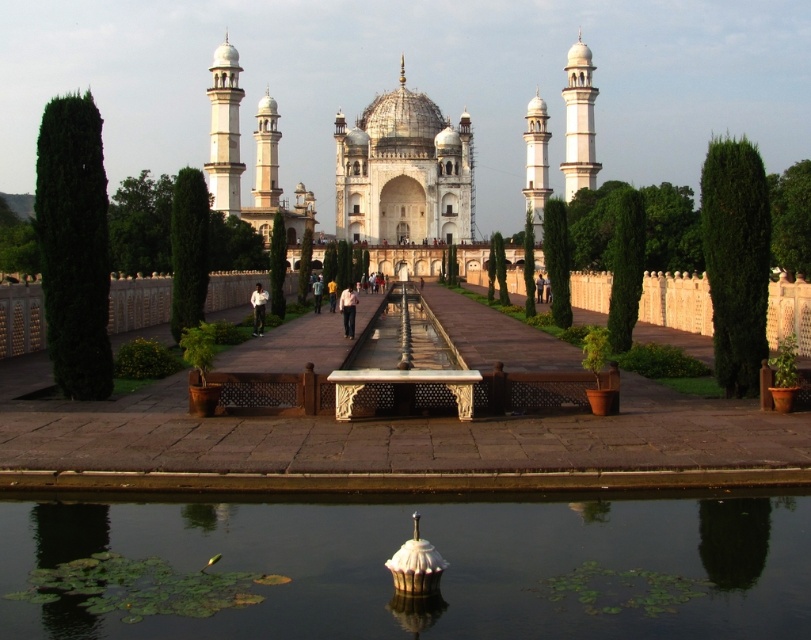
Is transparent glass water at center further to the viewer compared to white marble palace at center?

Result: No.

Between transparent glass water at center and white marble palace at center, which one appears on the left side from the viewer's perspective?

white marble palace at center

At what (x,y) coordinates should I click in order to perform the action: click on transparent glass water at center. Please return your answer as a coordinate pair (x, y). The image size is (811, 640). Looking at the image, I should click on pos(389,572).

I want to click on transparent glass water at center, so click(389, 572).